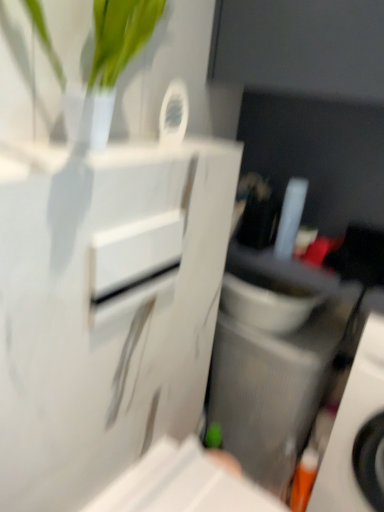
Question: Is orange plastic toothbrush at lower right next to white glossy drawer at center?

Choices:
 (A) yes
 (B) no

Answer: (B)

Question: Does orange plastic toothbrush at lower right have a greater width compared to white glossy drawer at center?

Choices:
 (A) yes
 (B) no

Answer: (A)

Question: From a real-world perspective, is orange plastic toothbrush at lower right beneath white glossy drawer at center?

Choices:
 (A) yes
 (B) no

Answer: (A)

Question: Is orange plastic toothbrush at lower right far from white glossy drawer at center?

Choices:
 (A) no
 (B) yes

Answer: (A)

Question: Would you say orange plastic toothbrush at lower right contains white glossy drawer at center?

Choices:
 (A) no
 (B) yes

Answer: (A)

Question: Is orange plastic toothbrush at lower right thinner than white glossy drawer at center?

Choices:
 (A) no
 (B) yes

Answer: (A)

Question: From the image's perspective, is white glossy drawer at center below gray textured speaker at lower right?

Choices:
 (A) no
 (B) yes

Answer: (A)

Question: Is white glossy drawer at center facing away from gray textured speaker at lower right?

Choices:
 (A) no
 (B) yes

Answer: (A)

Question: Considering the relative sizes of white glossy drawer at center and gray textured speaker at lower right in the image provided, is white glossy drawer at center taller than gray textured speaker at lower right?

Choices:
 (A) no
 (B) yes

Answer: (A)

Question: Considering the relative sizes of white glossy drawer at center and gray textured speaker at lower right in the image provided, is white glossy drawer at center smaller than gray textured speaker at lower right?

Choices:
 (A) yes
 (B) no

Answer: (A)

Question: Is white glossy drawer at center closer to the viewer compared to gray textured speaker at lower right?

Choices:
 (A) yes
 (B) no

Answer: (A)

Question: Can you confirm if white glossy drawer at center is positioned to the left of gray textured speaker at lower right?

Choices:
 (A) no
 (B) yes

Answer: (B)

Question: Can you confirm if gray textured speaker at lower right is taller than orange plastic toothbrush at lower right?

Choices:
 (A) no
 (B) yes

Answer: (A)